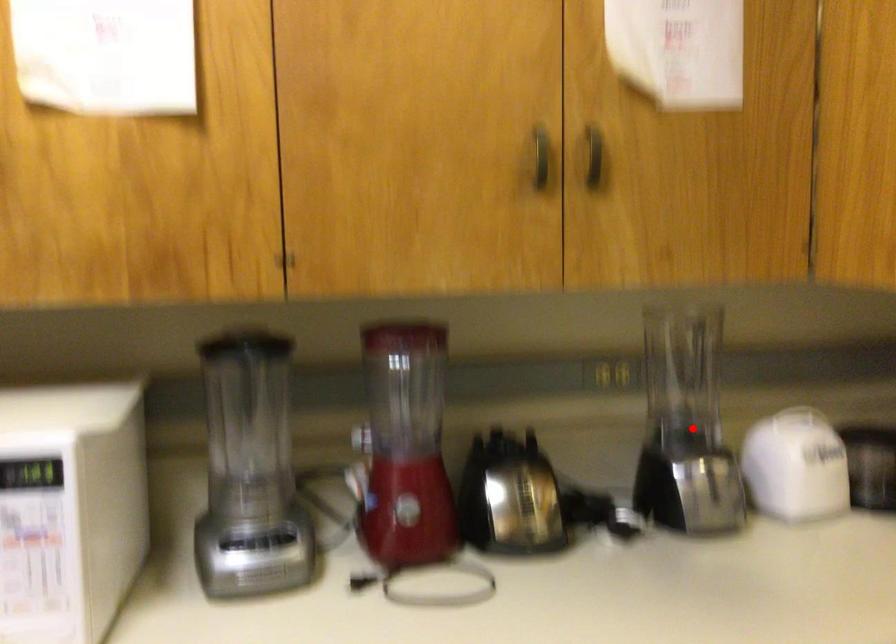
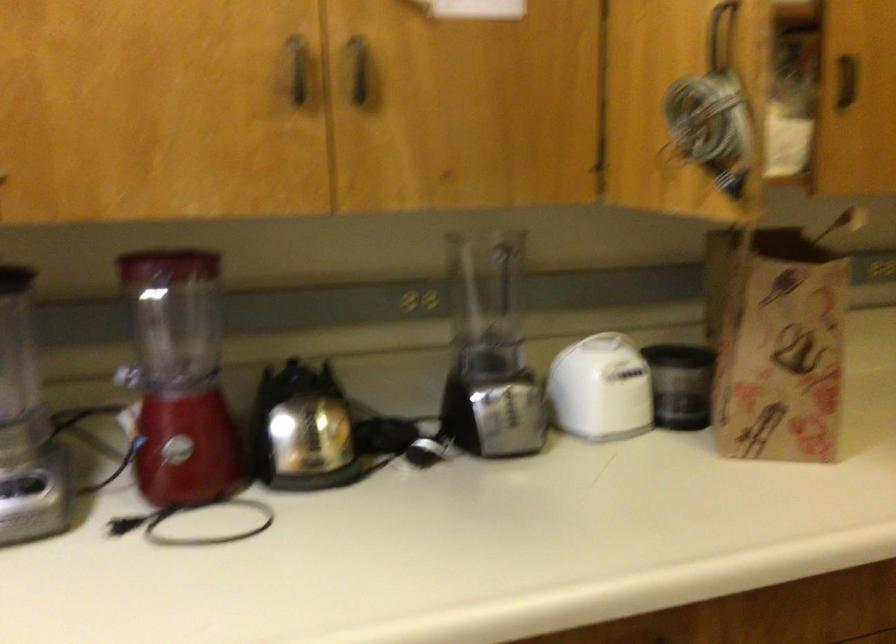
The point at the highlighted location is marked in the first image. Where is the corresponding point in the second image?

(489, 351)